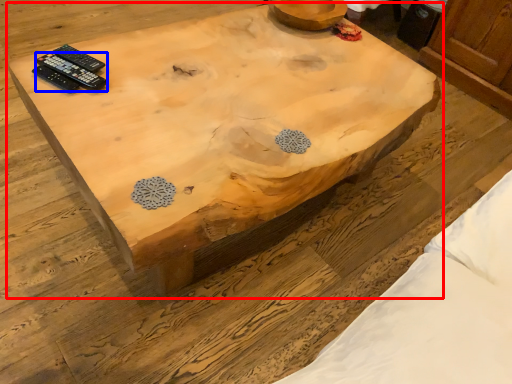
Question: Which of the following is the closest to the observer, coffee table (highlighted by a red box) or remote control (highlighted by a blue box)?

Choices:
 (A) coffee table
 (B) remote control

Answer: (A)